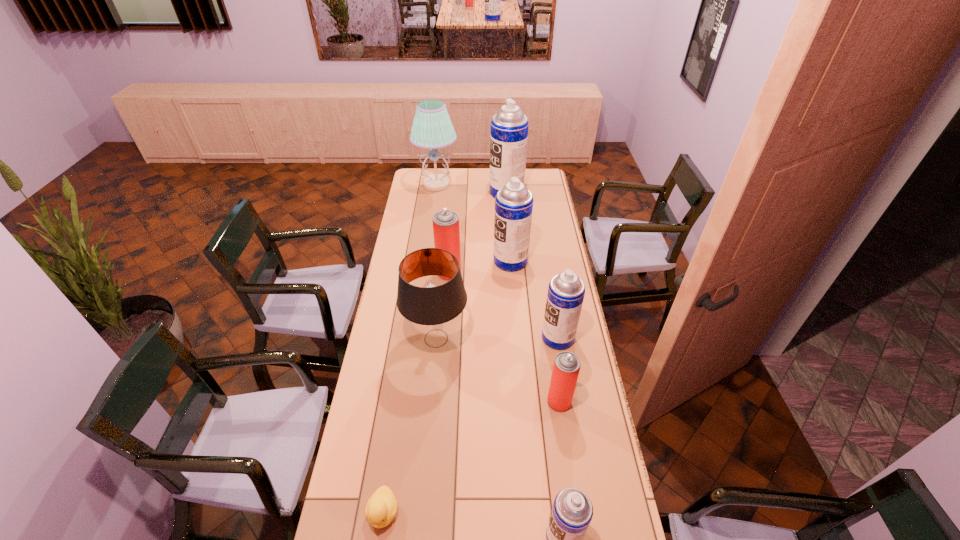
I want to click on the farthest blue aerosol can, so click(509, 127).

Locate an element on the screen. The width and height of the screenshot is (960, 540). the farthest aerosol can is located at coordinates (509, 127).

Where is `lamp`? This screenshot has height=540, width=960. lamp is located at coordinates (432, 128).

This screenshot has width=960, height=540. I want to click on the third smallest blue aerosol can, so click(x=514, y=202).

The image size is (960, 540). In order to click on the second tallest aerosol can in this screenshot , I will do `click(514, 202)`.

Locate an element on the screen. Image resolution: width=960 pixels, height=540 pixels. lampshade is located at coordinates (433, 312).

Where is `the left red aerosol can`? the left red aerosol can is located at coordinates pyautogui.click(x=446, y=230).

Where is `the farther red aerosol can`? This screenshot has height=540, width=960. the farther red aerosol can is located at coordinates (446, 230).

What are the coordinates of `the second nearest blue aerosol can` in the screenshot? It's located at (566, 291).

You are a GUI agent. You are given a task and a screenshot of the screen. Output one action in this format:
    pyautogui.click(x=<x>, y=<y>)
    Task: Click on the fourth farthest aerosol can
    
    Given the screenshot: What is the action you would take?
    pyautogui.click(x=566, y=291)